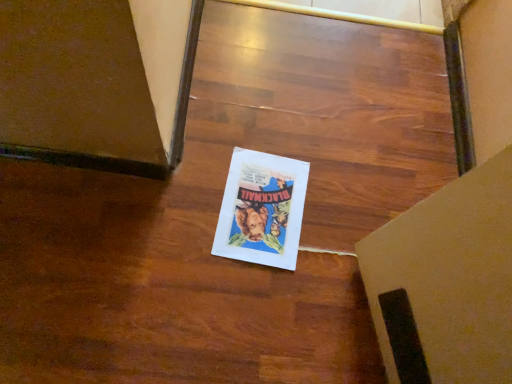
Find the location of a particular element. This screenshot has height=384, width=512. free point to the right of matte paper poster at center is located at coordinates (337, 222).